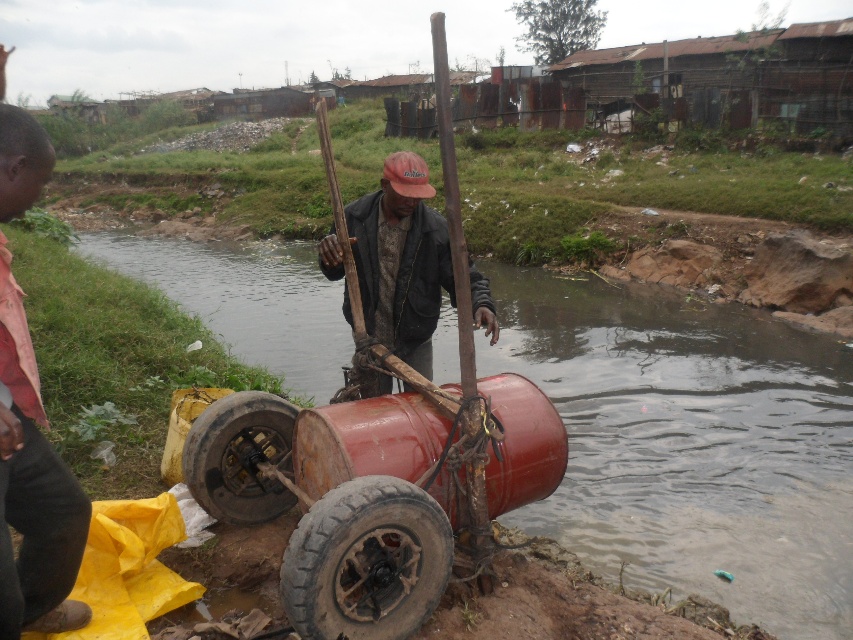
Between rusty metallic river at center and rusty metal wheel at center, which one is positioned higher?

rusty metallic river at center is above.

Which of these two, rusty metallic river at center or rusty metal wheel at center, stands taller?

Standing taller between the two is rusty metallic river at center.

Locate an element on the screen. rusty metallic river at center is located at coordinates (689, 444).

In order to click on rusty metallic river at center in this screenshot , I will do `click(689, 444)`.

Is rusty metallic river at center shorter than dirty rubber wheel at center?

No.

In order to click on rusty metallic river at center in this screenshot , I will do `click(689, 444)`.

Find the location of a particular element. rusty metallic river at center is located at coordinates (689, 444).

Where is `matte black jacket at center`? The height and width of the screenshot is (640, 853). matte black jacket at center is located at coordinates (401, 259).

The image size is (853, 640). Identify the location of matte black jacket at center. (401, 259).